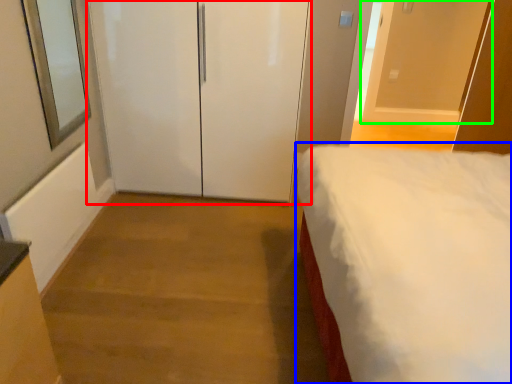
Question: Estimate the real-world distances between objects in this image. Which object is closer to door (highlighted by a red box), bed (highlighted by a blue box) or door (highlighted by a green box)?

Choices:
 (A) bed
 (B) door

Answer: (A)